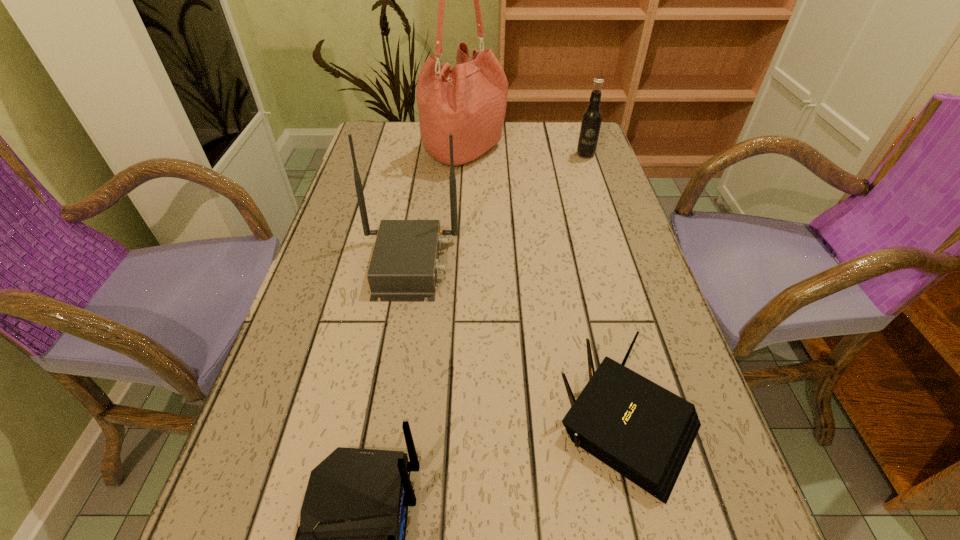
This screenshot has height=540, width=960. In order to click on router that is the second closest one to the second shortest object in this screenshot , I will do `click(404, 266)`.

What are the coordinates of `vacant space that satisfies the following two spatial constraints: 1. on the label of the root beer; 2. on the back of the tallest router to connect cables` in the screenshot? It's located at (621, 264).

I want to click on vacant space that satisfies the following two spatial constraints: 1. on the back of the rightmost router to connect cables; 2. on the right side of the third nearest object, so click(x=382, y=423).

Image resolution: width=960 pixels, height=540 pixels. In order to click on free space that satisfies the following two spatial constraints: 1. on the back of the third nearest object to connect cables; 2. on the right side of the rightmost router in this screenshot , I will do point(382,423).

What are the coordinates of `free space that satisfies the following two spatial constraints: 1. on the back of the shortest object to connect cables; 2. on the right side of the third nearest object` in the screenshot? It's located at (382, 423).